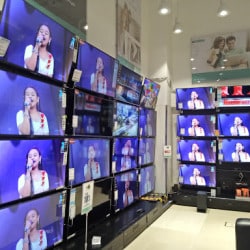
Locate an element on the screen. black tv is located at coordinates (103, 195), (87, 116).